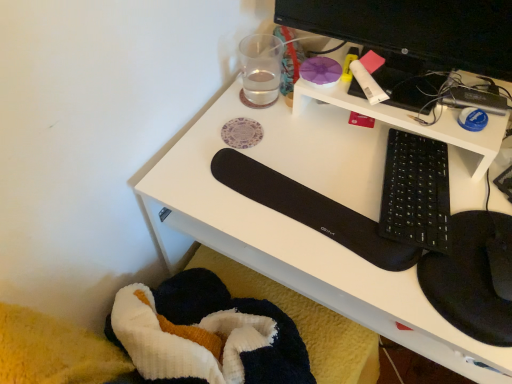
Where is `free point above black matte keyboard at center-right (from a real-world perspective)`? This screenshot has height=384, width=512. free point above black matte keyboard at center-right (from a real-world perspective) is located at coordinates (369, 198).